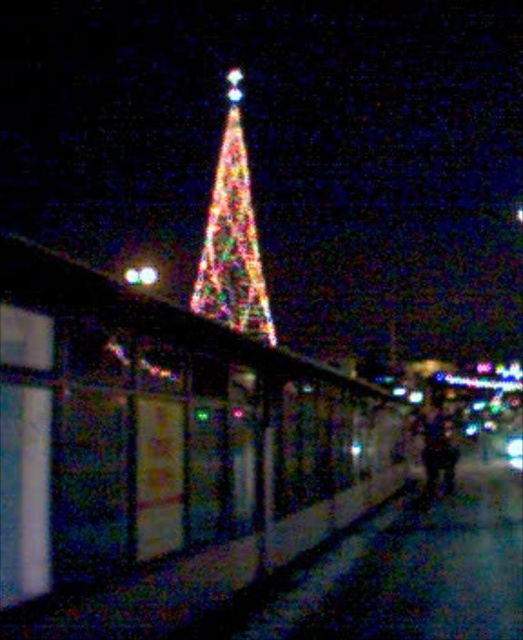
Who is more forward, (209, 220) or (441, 460)?

Point (441, 460)

Does iridescent glass christmas tree at center have a lesser height compared to multicolored fabric at center?

In fact, iridescent glass christmas tree at center may be taller than multicolored fabric at center.

This screenshot has height=640, width=523. Identify the location of iridescent glass christmas tree at center. (233, 237).

Where is `iridescent glass christmas tree at center`? iridescent glass christmas tree at center is located at coordinates (233, 237).